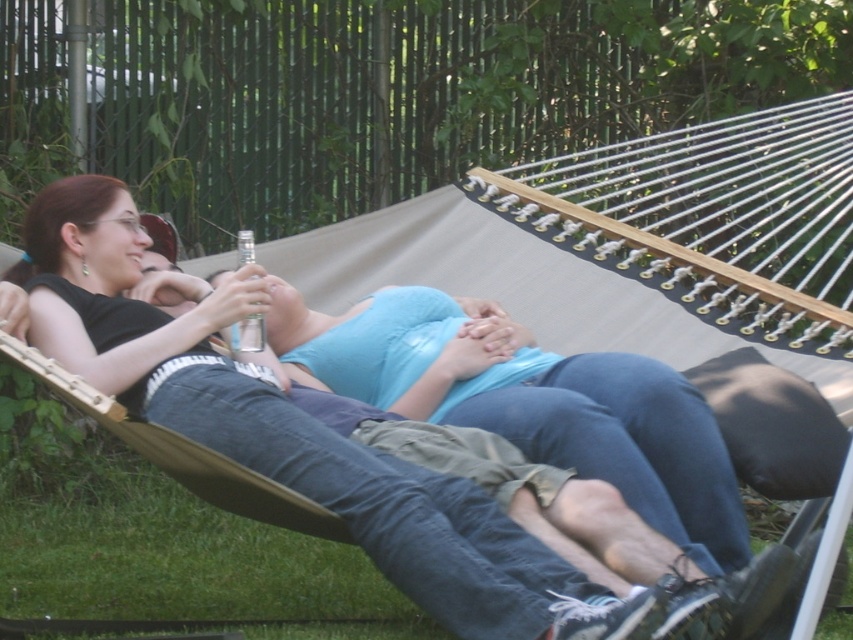
Question: Is blue denim jeans at center further to the viewer compared to denim jeans at center?

Choices:
 (A) yes
 (B) no

Answer: (A)

Question: From the image, what is the correct spatial relationship of blue denim jeans at center in relation to denim jeans at center?

Choices:
 (A) right
 (B) left

Answer: (A)

Question: Can you confirm if blue denim jeans at center is bigger than denim jeans at center?

Choices:
 (A) no
 (B) yes

Answer: (A)

Question: Which point appears farthest from the camera in this image?

Choices:
 (A) (96, 204)
 (B) (436, 308)

Answer: (B)

Question: Which object is closer to the camera taking this photo?

Choices:
 (A) denim jeans at center
 (B) blue denim jeans at center

Answer: (A)

Question: Which point is farther to the camera?

Choices:
 (A) blue denim jeans at center
 (B) denim jeans at center

Answer: (A)